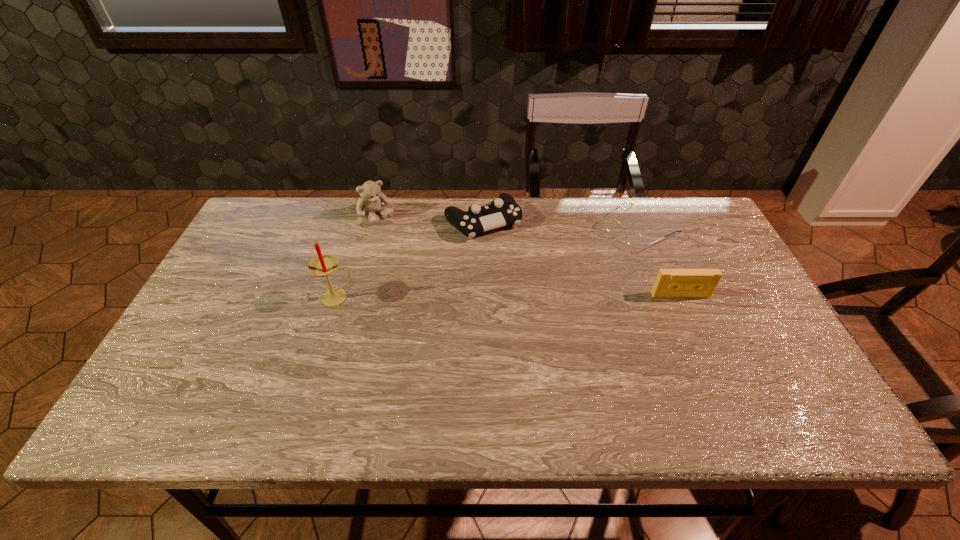
Where is `vacant region located 0.340m on the surface of the control`? Image resolution: width=960 pixels, height=540 pixels. vacant region located 0.340m on the surface of the control is located at coordinates (557, 323).

Where is `vacant space located on the surface of the control`? vacant space located on the surface of the control is located at coordinates (516, 267).

Image resolution: width=960 pixels, height=540 pixels. Find the location of `vacant area situated on the surface of the control`. vacant area situated on the surface of the control is located at coordinates (548, 312).

Find the location of `free space located on the face of the fourth shortest object`. free space located on the face of the fourth shortest object is located at coordinates (421, 261).

I want to click on vacant region located on the face of the fourth shortest object, so click(454, 293).

Where is `vacant region located 0.290m on the face of the fourth shortest object`? vacant region located 0.290m on the face of the fourth shortest object is located at coordinates (438, 276).

You are a GUI agent. You are given a task and a screenshot of the screen. Output one action in this format:
    pyautogui.click(x=<x>, y=<y>)
    Task: Click on the spectacles situated at the far edge
    
    Given the screenshot: What is the action you would take?
    pyautogui.click(x=634, y=239)

Where is `control at the far edge`? control at the far edge is located at coordinates (503, 211).

Identify the location of teddy bear positioned at the far edge. The width and height of the screenshot is (960, 540). (371, 198).

Where is `videotape situated at the right edge`? This screenshot has height=540, width=960. videotape situated at the right edge is located at coordinates (670, 283).